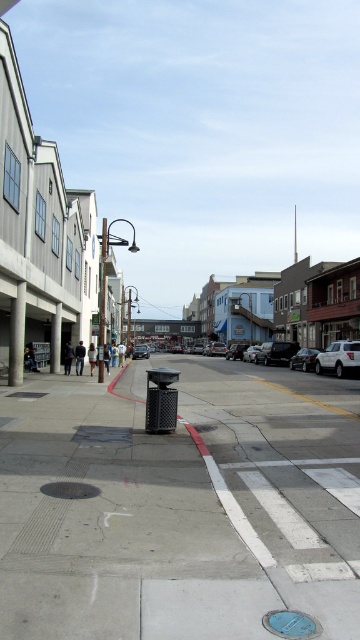
You are a pedestrian standing on the sidewalk looking down the street. You see a white matte car at right and a metallic silver sedan at center. Which car is closer to the sky?

The white matte car at right is located above the metallic silver sedan at center, so it is closer to the sky.

You are a delivery person trying to park your white matte car at right. The street has a red curb painted on the sidewalk. According to the scene, can your car fit between the concrete at center and the sidewalk?

The concrete at center is wider than the white matte car at right, so the car should fit between the concrete at center and the sidewalk as long as there is enough space along the curb.

You are standing on the sidewalk in the street scene. You see two points marked on the ground ahead of you. The first point is at coordinates point [295,353] and the second is at point [147,348]. Which point is closer to you?

Point [295,353] is closer to the viewer than point [147,348].